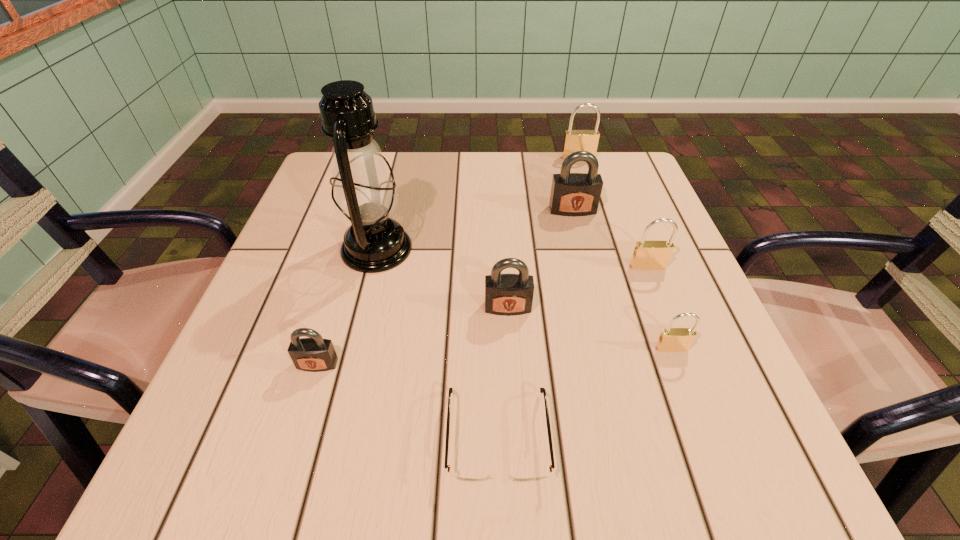
You are a GUI agent. You are given a task and a screenshot of the screen. Output one action in this format:
    pyautogui.click(x=<x>, y=<y>)
    Task: Click on the vacant space situated on the front-facing side of the second biggest brass padlock
    
    Given the screenshot: What is the action you would take?
    pyautogui.click(x=660, y=300)

I want to click on vacant position located on the front of the leftmost gray padlock near the keyhole, so click(299, 426).

Locate an element on the screen. Image resolution: width=960 pixels, height=540 pixels. vacant space positioned on the front-facing side of the smallest brass padlock is located at coordinates (701, 425).

Where is `object situated at the near edge`? Image resolution: width=960 pixels, height=540 pixels. object situated at the near edge is located at coordinates (462, 475).

Identify the location of oil lamp at the left edge. This screenshot has width=960, height=540. (364, 194).

Identify the location of padlock present at the left edge. The height and width of the screenshot is (540, 960). (315, 354).

Identify the location of free space at the far edge. The image size is (960, 540). (454, 201).

This screenshot has width=960, height=540. Identify the location of free region at the near edge of the desktop. (581, 463).

This screenshot has height=540, width=960. I want to click on vacant space at the left edge of the desktop, so click(320, 206).

You are a GUI agent. You are given a task and a screenshot of the screen. Output one action in this format:
    pyautogui.click(x=<x>, y=<y>)
    Task: Click on the blank space at the right edge of the desktop
    
    Given the screenshot: What is the action you would take?
    pyautogui.click(x=640, y=346)